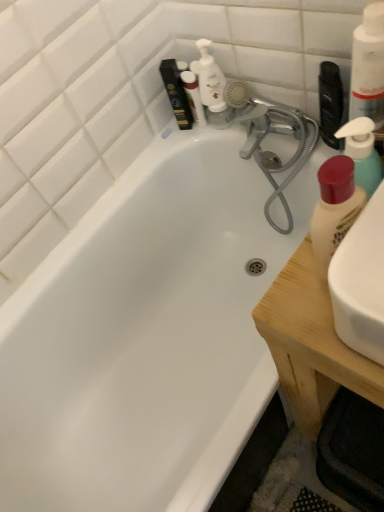
Where is `free spot in front of white plastic pump bottle at upper center`? This screenshot has width=384, height=512. free spot in front of white plastic pump bottle at upper center is located at coordinates (241, 131).